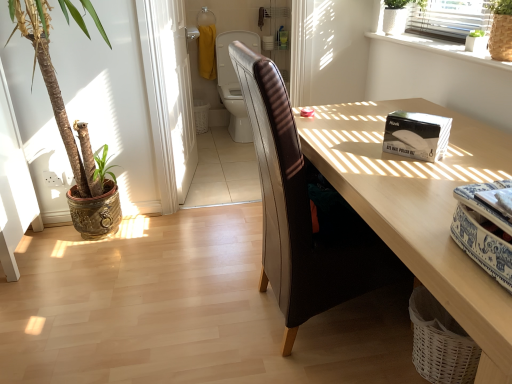
This screenshot has height=384, width=512. I want to click on free region on the left part of white glossy nail polish kit at upper right, so click(354, 149).